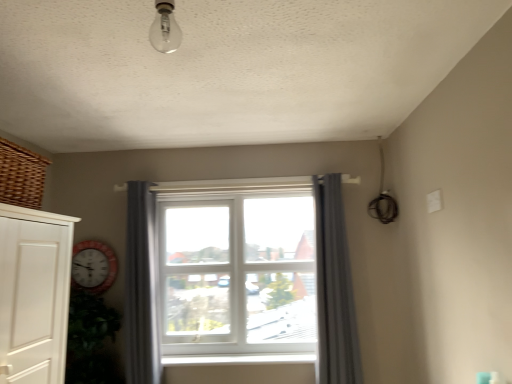
Question: Is white wooden clock at left oriented away from gray fabric curtain at center, the first curtain from the right?

Choices:
 (A) yes
 (B) no

Answer: (B)

Question: Is white wooden clock at left smaller than gray fabric curtain at center, arranged as the 2th curtain when viewed from the left?

Choices:
 (A) yes
 (B) no

Answer: (A)

Question: Is there a large distance between white wooden clock at left and gray fabric curtain at center, arranged as the 2th curtain when viewed from the left?

Choices:
 (A) no
 (B) yes

Answer: (B)

Question: Is white wooden clock at left next to gray fabric curtain at center, arranged as the 2th curtain when viewed from the left, and touching it?

Choices:
 (A) yes
 (B) no

Answer: (B)

Question: Can you confirm if white wooden clock at left is thinner than gray fabric curtain at center, the first curtain from the right?

Choices:
 (A) no
 (B) yes

Answer: (B)

Question: Does point (158, 1) appear closer or farther from the camera than point (94, 284)?

Choices:
 (A) closer
 (B) farther

Answer: (A)

Question: From the image's perspective, relative to white wooden clock at left, is clear glass bulb at upper center above or below?

Choices:
 (A) below
 (B) above

Answer: (B)

Question: Looking at the image, does clear glass bulb at upper center seem bigger or smaller compared to white wooden clock at left?

Choices:
 (A) big
 (B) small

Answer: (B)

Question: In terms of height, does clear glass bulb at upper center look taller or shorter compared to white wooden clock at left?

Choices:
 (A) short
 (B) tall

Answer: (A)

Question: Is woven brown basket at upper left inside the boundaries of white plastic window at center, or outside?

Choices:
 (A) outside
 (B) inside

Answer: (A)

Question: Relative to white plastic window at center, is woven brown basket at upper left in front or behind?

Choices:
 (A) behind
 (B) front

Answer: (B)

Question: From the image's perspective, is woven brown basket at upper left located above or below white plastic window at center?

Choices:
 (A) above
 (B) below

Answer: (A)

Question: Does point (10, 144) appear closer or farther from the camera than point (336, 263)?

Choices:
 (A) farther
 (B) closer

Answer: (B)

Question: In the image, is woven brown basket at upper left on the left side or the right side of clear glass bulb at upper center?

Choices:
 (A) left
 (B) right

Answer: (A)

Question: Considering the positions of point (13, 153) and point (169, 18), is point (13, 153) closer or farther from the camera than point (169, 18)?

Choices:
 (A) farther
 (B) closer

Answer: (A)